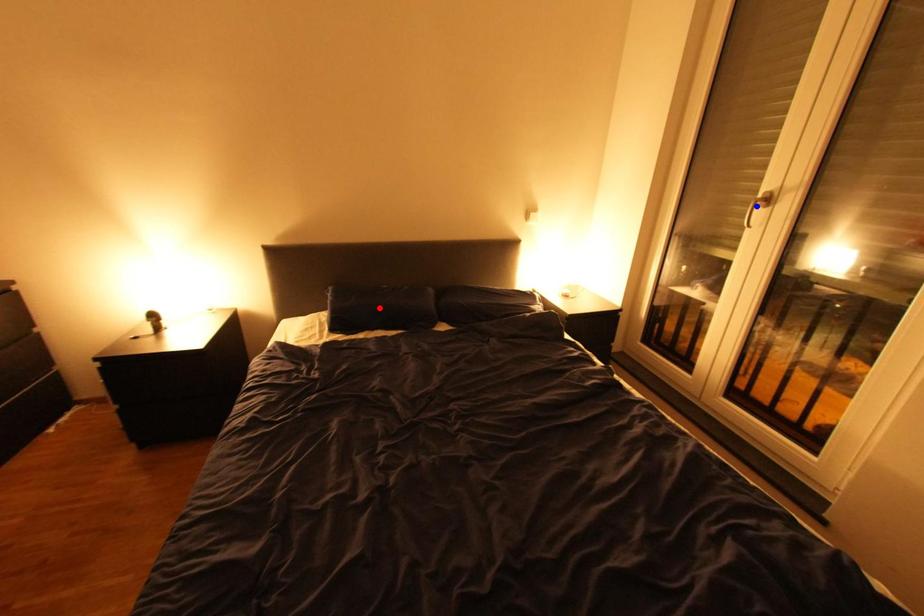
Question: Which of the two points in the image is closer to the camera?

Choices:
 (A) Blue point is closer.
 (B) Red point is closer.

Answer: (A)